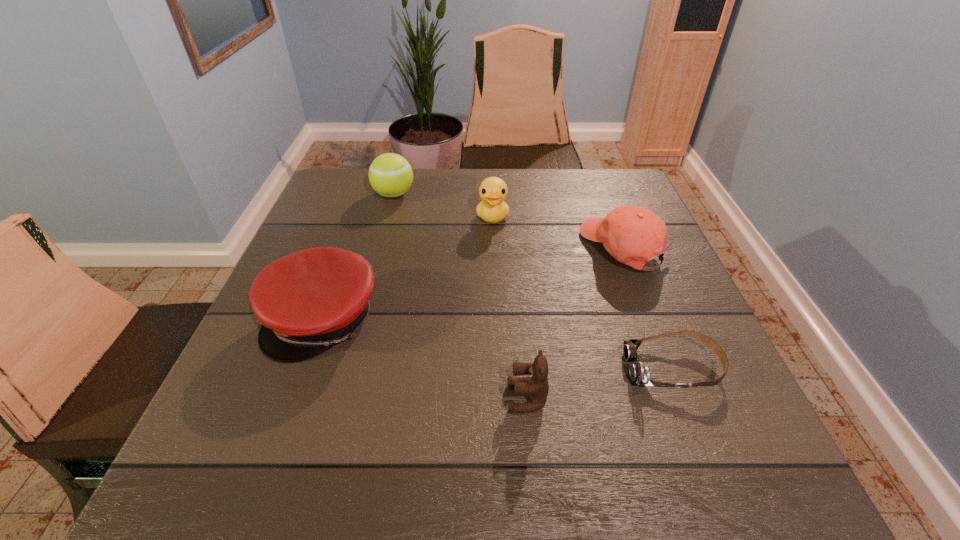
Find the location of `baseball cap located at the right edge`. baseball cap located at the right edge is located at coordinates (632, 235).

At what (x,y) coordinates should I click in order to perform the action: click on goggles that is at the right edge. Please return your answer as a coordinate pair (x, y). This screenshot has width=960, height=540. Looking at the image, I should click on (639, 374).

Find the location of a particular element. object situated at the far left corner is located at coordinates (390, 175).

In the image, there is a desktop. Where is `vacant space at the far edge`? vacant space at the far edge is located at coordinates coord(533,213).

In the image, there is a desktop. At what (x,y) coordinates should I click in order to perform the action: click on vacant space at the near edge. Please return your answer as a coordinate pair (x, y). Looking at the image, I should click on (568, 465).

Find the location of a particular element. blank space at the right edge of the desktop is located at coordinates (638, 325).

The image size is (960, 540). Identify the location of vacant space at the far right corner of the desktop. click(621, 190).

This screenshot has width=960, height=540. I want to click on vacant space at the near right corner of the desktop, so click(666, 456).

Where is `vacant area that lies between the baseball cap and the cap`? The width and height of the screenshot is (960, 540). vacant area that lies between the baseball cap and the cap is located at coordinates (473, 284).

At what (x,y) coordinates should I click in order to perform the action: click on empty space that is in between the baseball cap and the duck. Please return your answer as a coordinate pair (x, y). The width and height of the screenshot is (960, 540). Looking at the image, I should click on (558, 233).